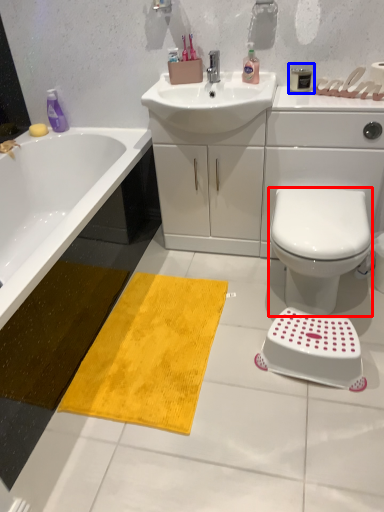
Question: Which point is further to the camera, bidet (highlighted by a red box) or toiletry (highlighted by a blue box)?

Choices:
 (A) bidet
 (B) toiletry

Answer: (B)